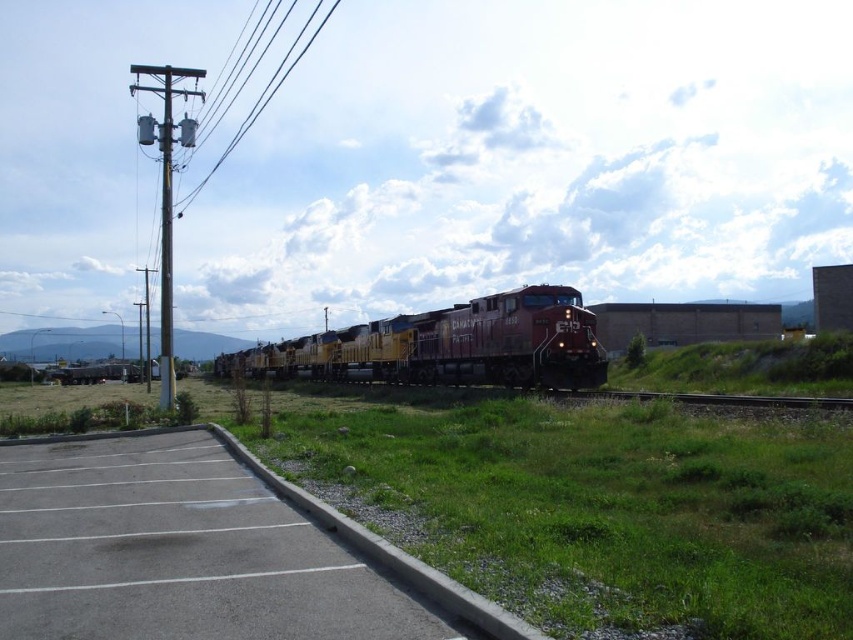
Does gray asphalt parking lot at lower left appear on the left side of reddish-brown metal train at center?

Incorrect, gray asphalt parking lot at lower left is not on the left side of reddish-brown metal train at center.

Which is in front, point (91, 490) or point (248, 365)?

Point (91, 490) is more forward.

Is point (318, 589) farther from viewer compared to point (502, 296)?

No, (318, 589) is in front of (502, 296).

Identify the location of gray asphalt parking lot at lower left. (177, 552).

Who is positioned more to the right, green grass at lower center or metallic pole at left?

Positioned to the right is green grass at lower center.

Is green grass at lower center bigger than metallic pole at left?

No.

Which is behind, point (761, 541) or point (279, 74)?

Point (279, 74)

The width and height of the screenshot is (853, 640). In order to click on green grass at lower center in this screenshot , I will do `click(587, 500)`.

Can you confirm if green grass at lower center is positioned to the left of gray asphalt parking lot at lower left?

Correct, you'll find green grass at lower center to the left of gray asphalt parking lot at lower left.

Describe the element at coordinates (587, 500) in the screenshot. The image size is (853, 640). I see `green grass at lower center` at that location.

Find the location of a particular element. This screenshot has height=640, width=853. green grass at lower center is located at coordinates (587, 500).